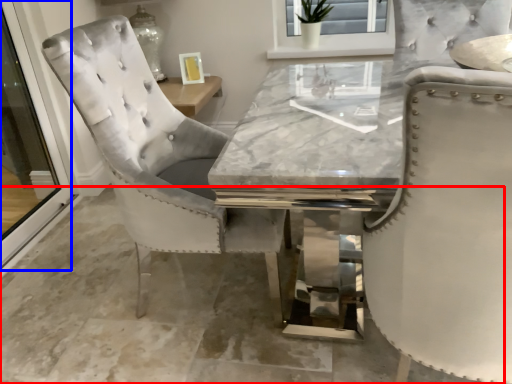
Question: Which object appears farthest to the camera in this image, concrete (highlighted by a red box) or screen door (highlighted by a blue box)?

Choices:
 (A) concrete
 (B) screen door

Answer: (B)